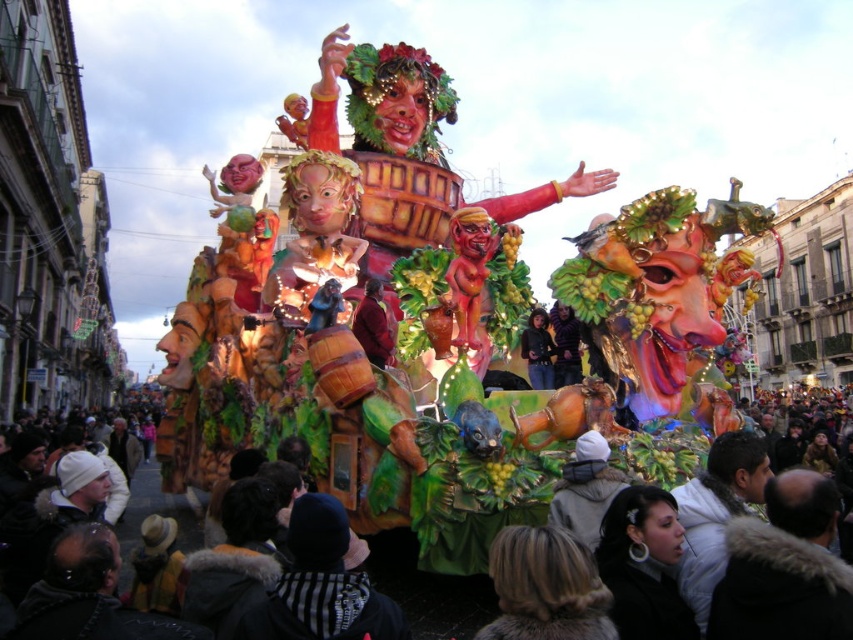
Is matte brown coat at center smaller than matte black jacket at center?

Actually, matte brown coat at center might be larger than matte black jacket at center.

Based on the photo, who is positioned more to the left, matte brown coat at center or matte black jacket at center?

matte brown coat at center

Who is more distant from viewer, (363, 314) or (521, 344)?

Point (521, 344)

Find the location of a particular element. matte brown coat at center is located at coordinates (374, 324).

Is point (480, 572) positioned after point (374, 301)?

No.

At what (x,y) coordinates should I click in order to perform the action: click on dark brown fur coat at lower center. Please return your answer as a coordinate pair (x, y). Looking at the image, I should click on (428, 588).

Is point (392, 541) positioned in front of point (357, 320)?

Yes, point (392, 541) is in front of point (357, 320).

At what (x,y) coordinates should I click in order to perform the action: click on dark brown fur coat at lower center. Please return your answer as a coordinate pair (x, y). The height and width of the screenshot is (640, 853). Looking at the image, I should click on (428, 588).

Between dark brown fur coat at lower center and matte black jacket at center, which one has more height?

Standing taller between the two is dark brown fur coat at lower center.

This screenshot has height=640, width=853. Describe the element at coordinates (428, 588) in the screenshot. I see `dark brown fur coat at lower center` at that location.

Between point (189, 508) and point (524, 346), which one is positioned in front?

Positioned in front is point (524, 346).

Where is `dark brown fur coat at lower center`? dark brown fur coat at lower center is located at coordinates (428, 588).